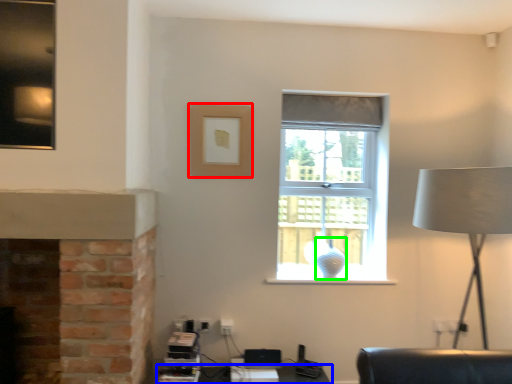
Question: Estimate the real-world distances between objects in this image. Which object is closer to picture frame (highlighted by a red box), table (highlighted by a blue box) or glass vase (highlighted by a green box)?

Choices:
 (A) table
 (B) glass vase

Answer: (B)